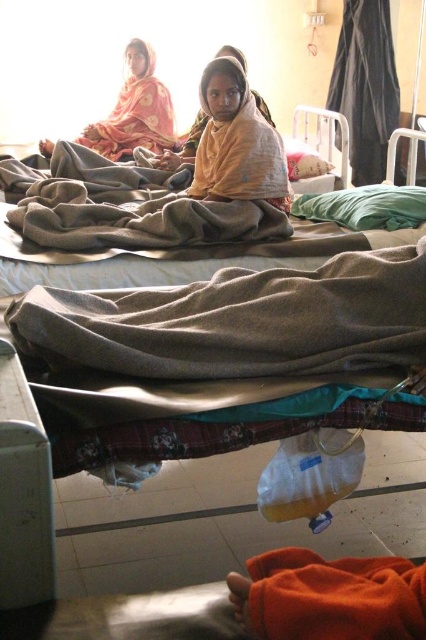
Who is more distant from viewer, (386,248) or (222,189)?

Point (222,189)

Can you confirm if beige woolen blanket at center is positioned above yellow fabric at center?

Incorrect, beige woolen blanket at center is not positioned above yellow fabric at center.

Does point (167, 291) come in front of point (215, 196)?

That is True.

The height and width of the screenshot is (640, 426). Identify the location of beige woolen blanket at center. (238, 321).

Which of these two, beige woolen blanket at center or matte orange shawl at upper left, stands shorter?

beige woolen blanket at center is shorter.

Who is more forward, [192,376] or [48,148]?

Point [192,376] is more forward.

Identify the location of beige woolen blanket at center. (238, 321).

Is gray woolen blanket at center to the right of matte orange shawl at upper left from the viewer's perspective?

Correct, you'll find gray woolen blanket at center to the right of matte orange shawl at upper left.

Does point (69, 170) lie behind point (98, 129)?

No.

Identify the location of gray woolen blanket at center. (124, 205).